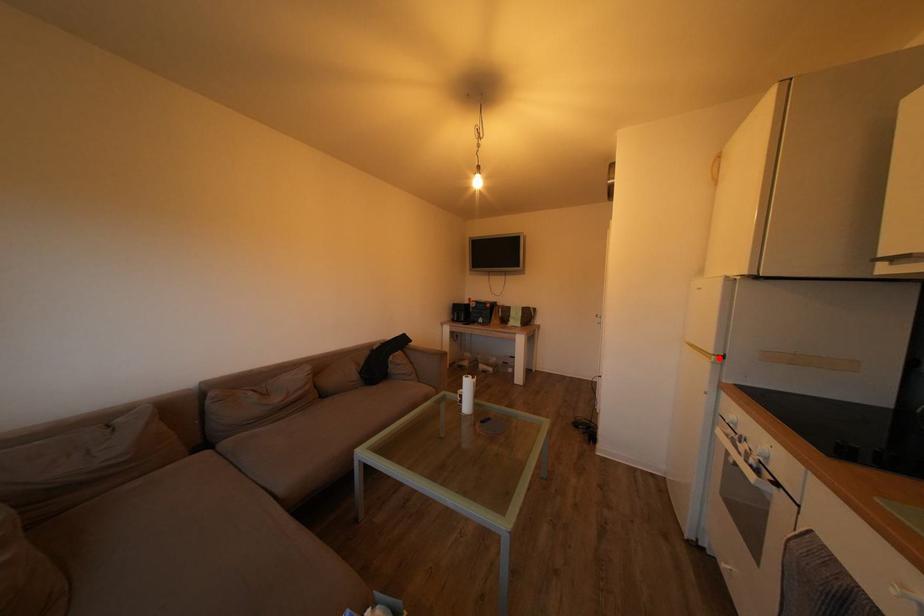
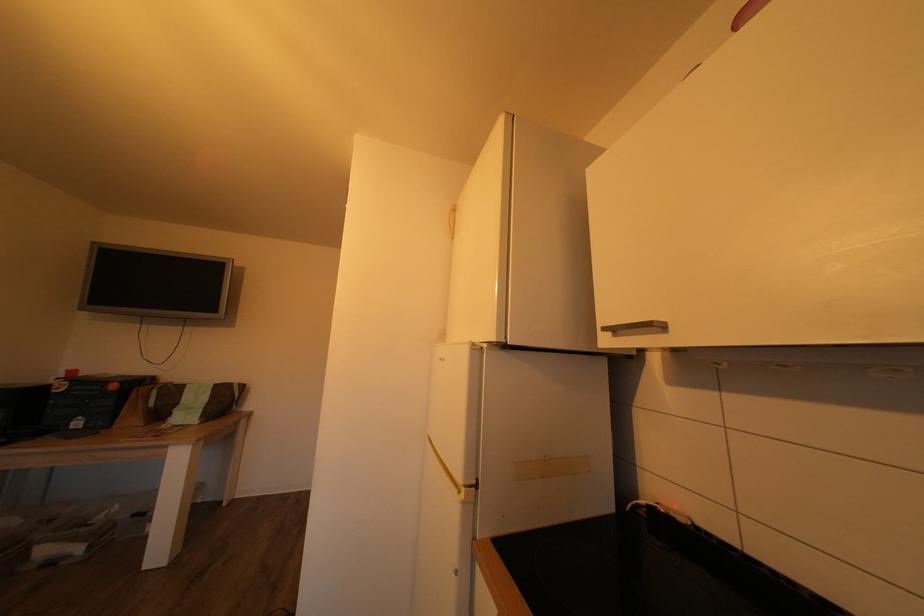
Find the pixel in the second image that matches the highlighted location in the first image.

(468, 487)